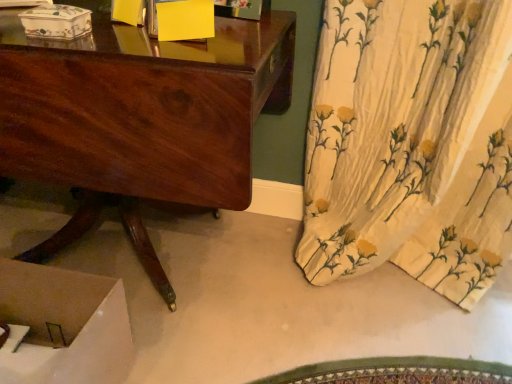
Where is `vacant space underneath shiny brown wood desk at center (from a real-world perspective)`? vacant space underneath shiny brown wood desk at center (from a real-world perspective) is located at coordinates (159, 242).